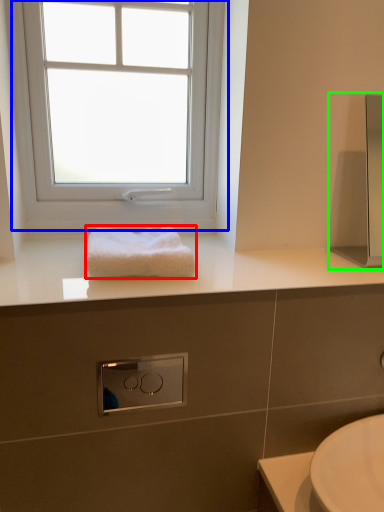
Question: Which is nearer to the towel (highlighted by a red box)? window (highlighted by a blue box) or medicine cabinet (highlighted by a green box).

Choices:
 (A) window
 (B) medicine cabinet

Answer: (A)